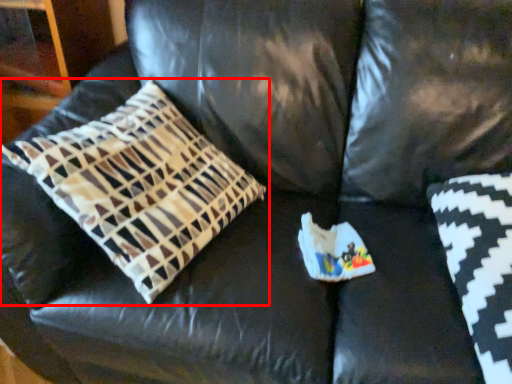
Question: From the image's perspective, where is pillow (annotated by the red box) located in relation to pillow in the image?

Choices:
 (A) above
 (B) below

Answer: (A)